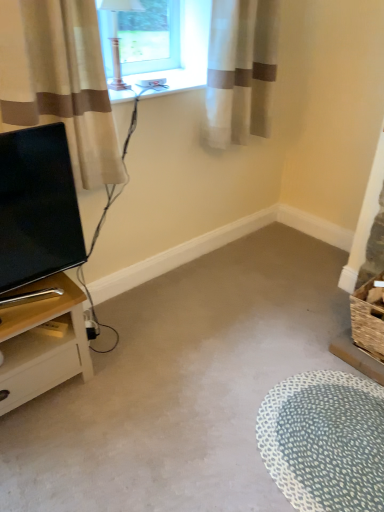
I want to click on vacant position to the left of white dotted rug at lower right, so 193,453.